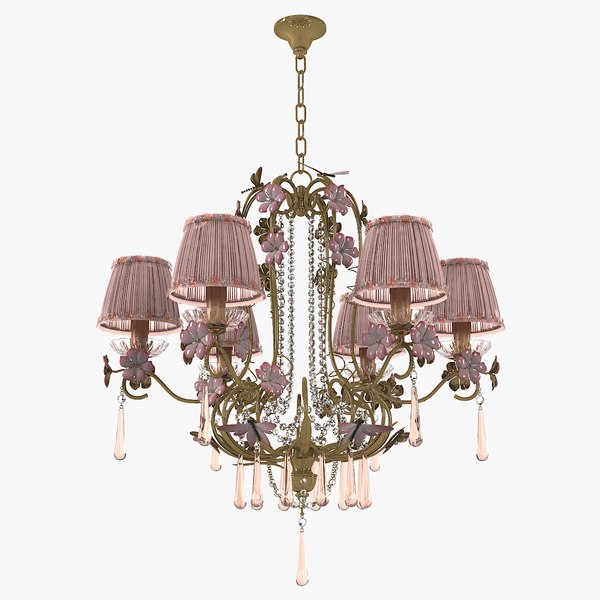
Locate an element on the screen. Image resolution: width=600 pixels, height=600 pixels. inside of lamp shade is located at coordinates (232, 293), (372, 291), (445, 325), (120, 325).